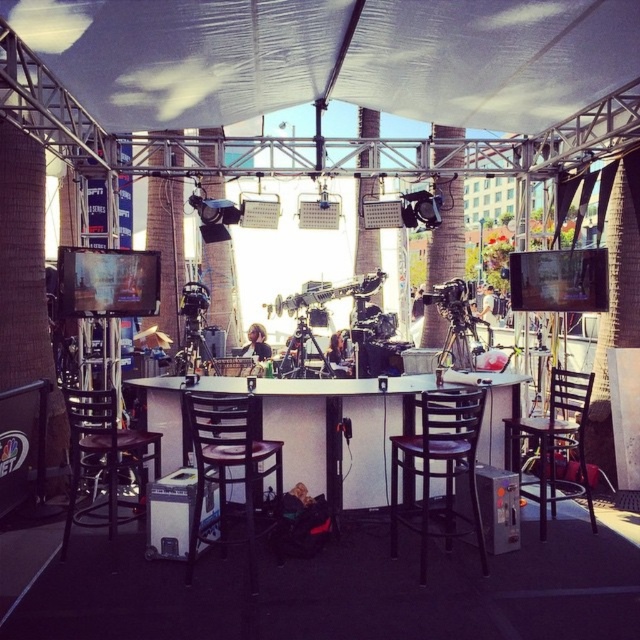
Question: Can you confirm if brown wooden chair at left is positioned to the left of brown wooden chair at center?

Choices:
 (A) no
 (B) yes

Answer: (B)

Question: Among these objects, which one is farthest from the camera?

Choices:
 (A) transparent fabric canopy at center
 (B) white laminate table at center
 (C) matte black tripod at center
 (D) black wood chair at right

Answer: (C)

Question: Does black wood chair at right have a larger size compared to metallic tripod at center?

Choices:
 (A) no
 (B) yes

Answer: (B)

Question: Can you confirm if transparent fabric canopy at center is positioned above black wood chair at right?

Choices:
 (A) no
 (B) yes

Answer: (B)

Question: Which point is closer to the camera?

Choices:
 (A) matte black tripod at center
 (B) metallic tripod at center

Answer: (B)

Question: Which point appears closest to the camera in this image?

Choices:
 (A) (154, 81)
 (B) (131, 506)
 (C) (349, 470)
 (D) (189, 353)

Answer: (B)